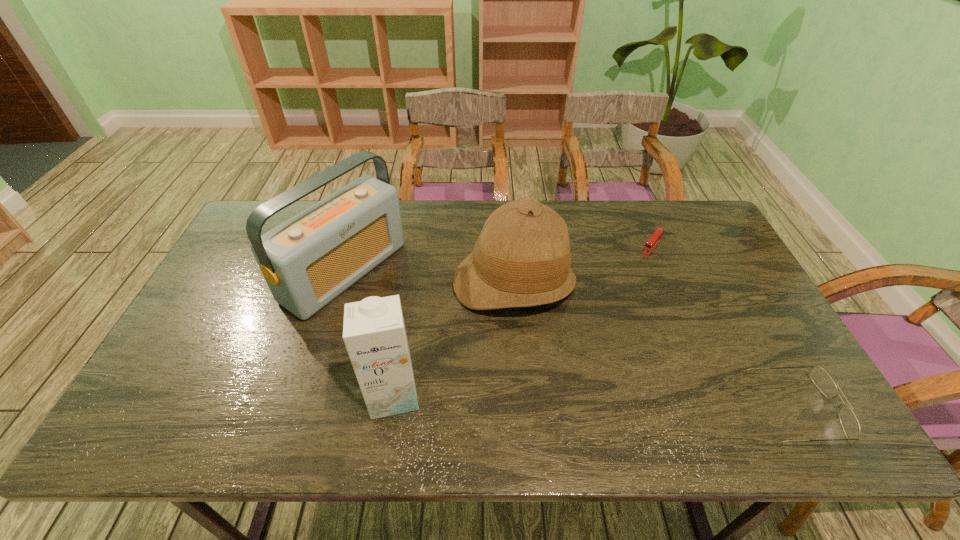
Locate an element on the screen. blank space located 0.140m on the front-facing side of the stapler is located at coordinates click(629, 278).

The height and width of the screenshot is (540, 960). I want to click on vacant region located on the front-facing side of the hat, so click(535, 367).

This screenshot has height=540, width=960. What are the coordinates of `vacant space located on the front-facing side of the hat` in the screenshot? It's located at (543, 403).

Image resolution: width=960 pixels, height=540 pixels. I want to click on vacant space located on the front-facing side of the hat, so click(x=538, y=377).

Locate an element on the screen. vacant space located on the front-facing side of the radio receiver is located at coordinates (470, 354).

Where is `free space located on the front-facing side of the radio receiver`? This screenshot has width=960, height=540. free space located on the front-facing side of the radio receiver is located at coordinates (396, 308).

Locate an element on the screen. This screenshot has width=960, height=540. vacant space located on the front-facing side of the radio receiver is located at coordinates (440, 335).

This screenshot has width=960, height=540. Find the location of `stapler positioned at the far edge`. stapler positioned at the far edge is located at coordinates (658, 234).

This screenshot has height=540, width=960. Find the location of `radio receiver present at the far edge`. radio receiver present at the far edge is located at coordinates (307, 261).

At what (x,y) coordinates should I click in order to perform the action: click on carton positioned at the near edge. Please return your answer as a coordinate pair (x, y). Looking at the image, I should click on (374, 333).